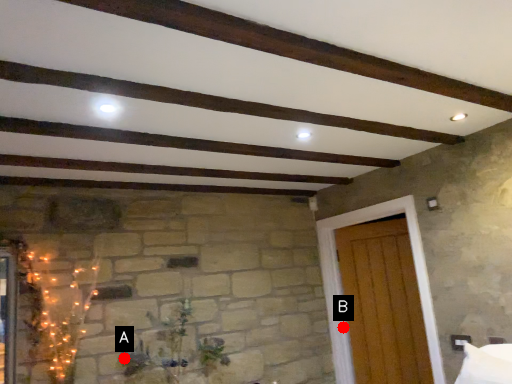
Question: Two points are circled on the image, labeled by A and B beside each circle. Which of the following is the farthest from the observer?

Choices:
 (A) A is further
 (B) B is further

Answer: (B)